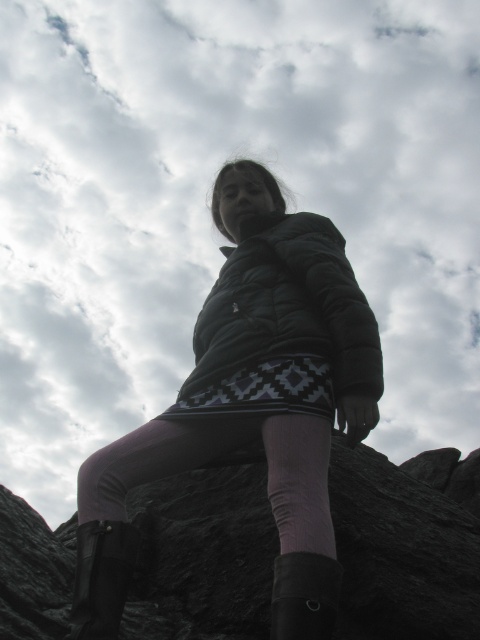
Is black puffy jacket at center bigger than black rubber boot at lower left?

Yes.

Can you confirm if black puffy jacket at center is positioned to the left of black rubber boot at lower left?

No, black puffy jacket at center is not to the left of black rubber boot at lower left.

Is point (219, 305) less distant than point (106, 592)?

No.

Where is `black puffy jacket at center`? This screenshot has width=480, height=640. black puffy jacket at center is located at coordinates (288, 307).

Is black puffy jacket at center bigger than black suede boot at lower center?

Correct, black puffy jacket at center is larger in size than black suede boot at lower center.

Between black puffy jacket at center and black suede boot at lower center, which one has less height?

black suede boot at lower center

Who is more distant from viewer, (356, 308) or (276, 557)?

Point (356, 308)

I want to click on black puffy jacket at center, so click(x=288, y=307).

Is pink fabric sock at lower center shorter than black rubber boot at lower left?

No, pink fabric sock at lower center is not shorter than black rubber boot at lower left.

Where is `pink fabric sock at lower center`? This screenshot has width=480, height=640. pink fabric sock at lower center is located at coordinates (300, 481).